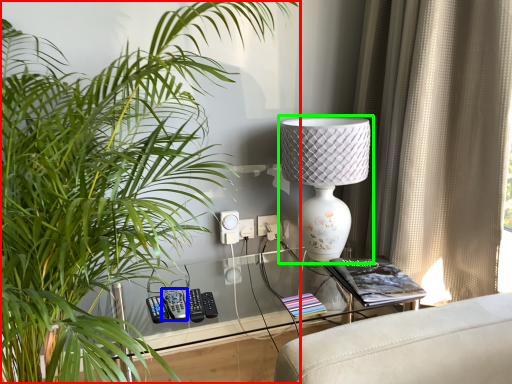
Question: Based on their relative distances, which object is nearer to houseplant (highlighted by a red box)? Choose from control (highlighted by a blue box) and lamp (highlighted by a green box).

Choices:
 (A) control
 (B) lamp

Answer: (A)